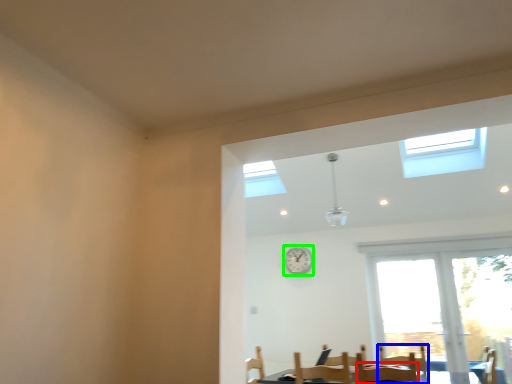
Question: Estimate the real-world distances between objects in this image. Which object is farther from chair (highlighted by a red box), armchair (highlighted by a blue box) or clock (highlighted by a green box)?

Choices:
 (A) armchair
 (B) clock

Answer: (B)